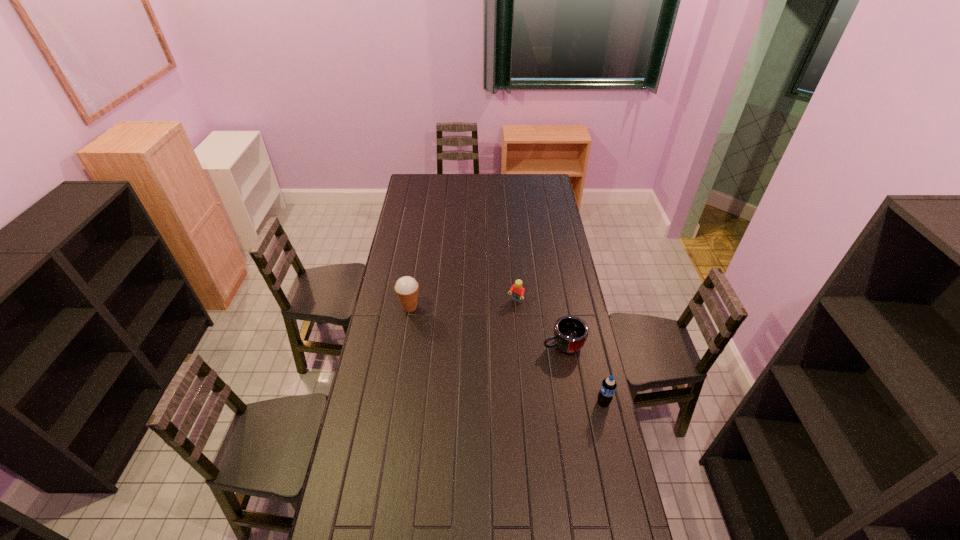
At what (x,y) coordinates should I click in order to perform the action: click on free space on the desktop that is between the leftmost object and the soda bottle and is positioned on the face of the third object from right to left. Please return your answer as a coordinate pair (x, y). The image size is (960, 540). Looking at the image, I should click on (482, 343).

Where is `vacant spot on the desktop that is between the leftmost object and the soda bottle and is positioned on the side of the second nearest object with the handle`? This screenshot has width=960, height=540. vacant spot on the desktop that is between the leftmost object and the soda bottle and is positioned on the side of the second nearest object with the handle is located at coordinates pos(515,359).